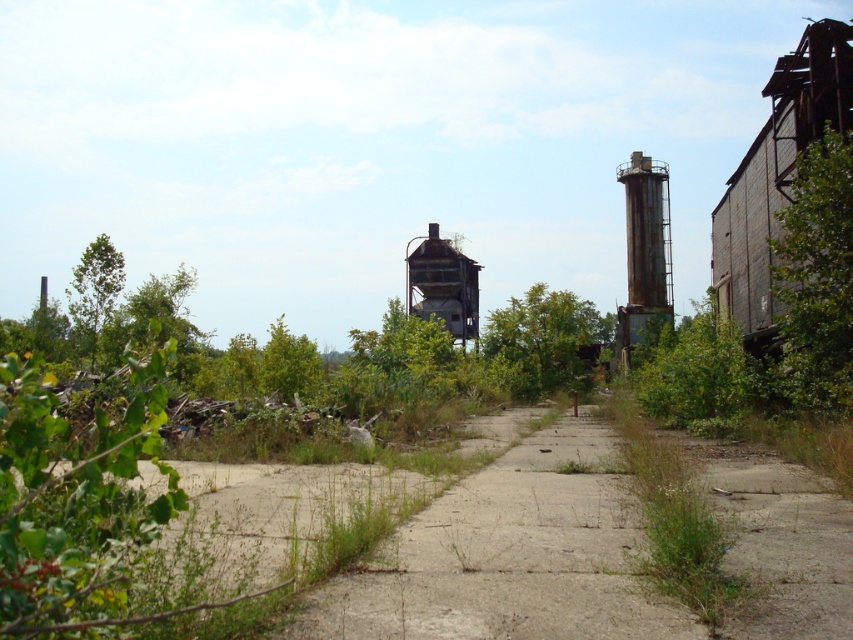
You are a hiker lost in an abandoned industrial area. You see a green leafy tree at center and a rusty metal water tower at center. Which object is closer to the right edge of the image?

The green leafy tree at center is positioned on the right side of rusty metal water tower at center, so it is closer to the right edge of the image.

You are a photographer planning to capture a wide shot of the abandoned industrial site. You want to ensure both the green leafy tree at center and the rusty metal water tower at center are clearly visible in the frame. Given their sizes, which object will occupy more space in your photograph?

The green leafy tree at center is larger in size than the rusty metal water tower at center, so it will occupy more space in the photograph.